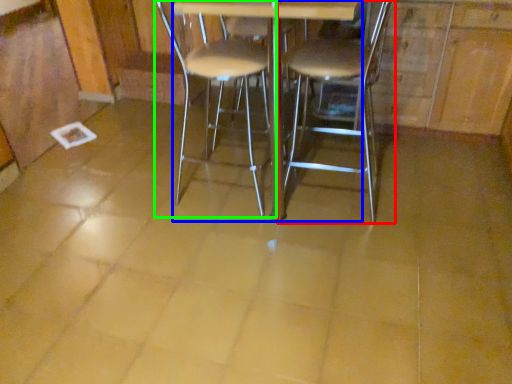
Question: Which is nearer to the chair (highlighted by a red box)? round table (highlighted by a blue box) or chair (highlighted by a green box).

Choices:
 (A) round table
 (B) chair

Answer: (B)